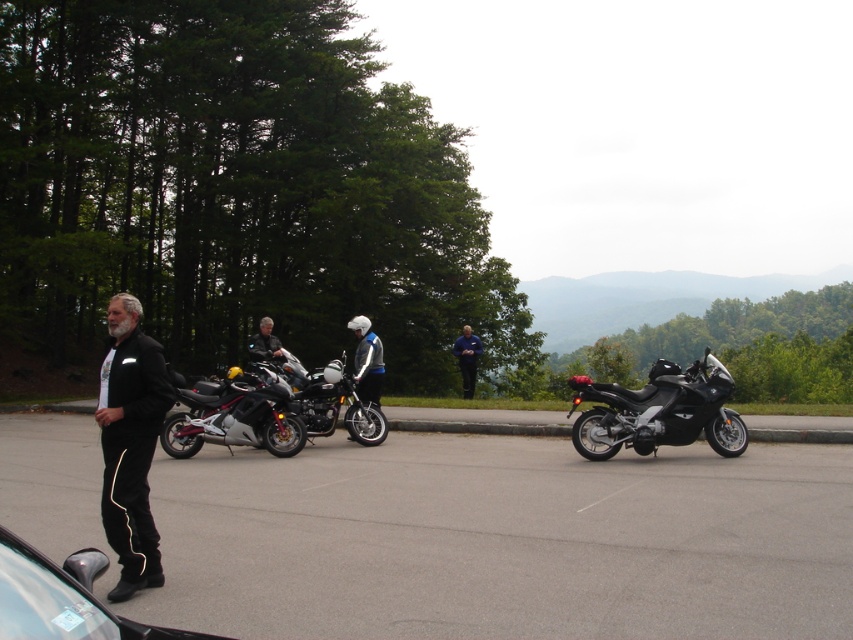
Between point (287, 374) and point (474, 364), which one is positioned in front?

Point (287, 374) is more forward.

This screenshot has width=853, height=640. In order to click on shiny silver motorcycle at center in this screenshot , I will do `click(334, 401)`.

Which is in front, point (689, 612) or point (15, 632)?

Point (15, 632) is more forward.

Does point (693, 570) lie in front of point (137, 637)?

No, it is behind (137, 637).

I want to click on gray asphalt parking lot at center, so click(503, 540).

Identify the location of gray asphalt parking lot at center. (503, 540).

Can you confirm if black glossy car at lower left is thinner than shiny silver motorcycle at center?

In fact, black glossy car at lower left might be wider than shiny silver motorcycle at center.

The width and height of the screenshot is (853, 640). In order to click on black glossy car at lower left in this screenshot , I will do `click(62, 598)`.

Identify the location of black glossy car at lower left. (62, 598).